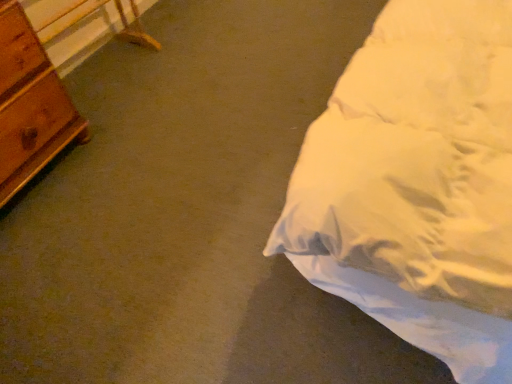
The height and width of the screenshot is (384, 512). What do you see at coordinates (30, 105) in the screenshot?
I see `wooden chest of drawers at left` at bounding box center [30, 105].

What are the coordinates of `wooden chest of drawers at left` in the screenshot? It's located at (30, 105).

Measure the distance between point (x=13, y=111) and camera.

A distance of 4.44 feet exists between point (x=13, y=111) and camera.

What do you see at coordinates (72, 28) in the screenshot? This screenshot has height=384, width=512. I see `wooden table at left` at bounding box center [72, 28].

In order to click on wooden table at left in this screenshot , I will do `click(72, 28)`.

Where is `wooden chest of drawers at left`? The width and height of the screenshot is (512, 384). wooden chest of drawers at left is located at coordinates (30, 105).

Is wooden table at left at the left side of wooden chest of drawers at left?

No, wooden table at left is not to the left of wooden chest of drawers at left.

In the image, is wooden table at left positioned in front of or behind wooden chest of drawers at left?

Clearly, wooden table at left is behind wooden chest of drawers at left.

Is point (65, 14) positioned behind point (32, 147)?

Yes, it is behind point (32, 147).

From the image's perspective, does wooden table at left appear lower than wooden chest of drawers at left?

No, from the image's perspective, wooden table at left is not below wooden chest of drawers at left.

From a real-world perspective, which is physically below, wooden table at left or wooden chest of drawers at left?

From a 3D spatial view, wooden table at left is below.

Can you confirm if wooden table at left is wider than wooden chest of drawers at left?

No, wooden table at left is not wider than wooden chest of drawers at left.

Considering the relative sizes of wooden table at left and wooden chest of drawers at left in the image provided, is wooden table at left taller than wooden chest of drawers at left?

No.

In terms of size, does wooden table at left appear bigger or smaller than wooden chest of drawers at left?

In the image, wooden table at left appears to be smaller than wooden chest of drawers at left.

Choose the correct answer: Is wooden table at left inside wooden chest of drawers at left or outside it?

wooden table at left cannot be found inside wooden chest of drawers at left.

In the scene shown: Would you say wooden table at left is a long distance from wooden chest of drawers at left?

No, wooden table at left is not far from wooden chest of drawers at left.

Is wooden table at left turned away from wooden chest of drawers at left?

wooden table at left is not turned away from wooden chest of drawers at left.

What are the coordinates of `chest of drawers below the wooden table at left (from the image's perspective)` in the screenshot? It's located at (30, 105).

Considering the positions of objects wooden chest of drawers at left and wooden table at left in the image provided, who is more to the left, wooden chest of drawers at left or wooden table at left?

wooden chest of drawers at left is more to the left.

Is wooden chest of drawers at left further to camera compared to wooden table at left?

That is False.

From the picture: Which is farther from the camera, (24, 169) or (106, 32)?

Positioned behind is point (106, 32).

From the image's perspective, is wooden chest of drawers at left on top of wooden table at left?

Actually, wooden chest of drawers at left appears below wooden table at left in the image.

From a real-world perspective, which object stands above the other?

wooden chest of drawers at left.

Between wooden chest of drawers at left and wooden table at left, which one has smaller width?

With smaller width is wooden table at left.

Based on the photo, can you confirm if wooden chest of drawers at left is shorter than wooden table at left?

No, wooden chest of drawers at left is not shorter than wooden table at left.

In terms of size, does wooden chest of drawers at left appear bigger or smaller than wooden table at left?

Considering their sizes, wooden chest of drawers at left takes up more space than wooden table at left.

Can we say wooden chest of drawers at left lies outside wooden table at left?

Absolutely, wooden chest of drawers at left is external to wooden table at left.

In the scene shown: Is wooden chest of drawers at left not near wooden table at left?

No.

Is wooden chest of drawers at left turned away from wooden table at left?

wooden chest of drawers at left does not have its back to wooden table at left.

Locate an element on the screen. The image size is (512, 384). the chest of drawers that appears below the wooden table at left (from the image's perspective) is located at coordinates (30, 105).

There is a wooden table at left. Where is `the chest of drawers above it (from a real-world perspective)`? The width and height of the screenshot is (512, 384). the chest of drawers above it (from a real-world perspective) is located at coordinates (30, 105).

Where is `chest of drawers that appears on the left of wooden table at left`? Image resolution: width=512 pixels, height=384 pixels. chest of drawers that appears on the left of wooden table at left is located at coordinates (30, 105).